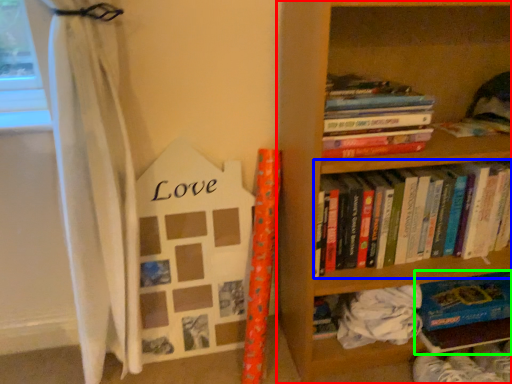
Question: Estimate the real-world distances between objects in this image. Which object is farther from bookcase (highlighted by a red box), book (highlighted by a blue box) or book (highlighted by a green box)?

Choices:
 (A) book
 (B) book

Answer: (B)